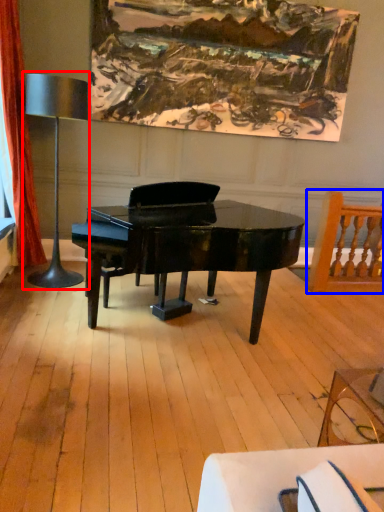
Question: Which point is further to the camera, table lamp (highlighted by a red box) or chair (highlighted by a blue box)?

Choices:
 (A) table lamp
 (B) chair

Answer: (B)